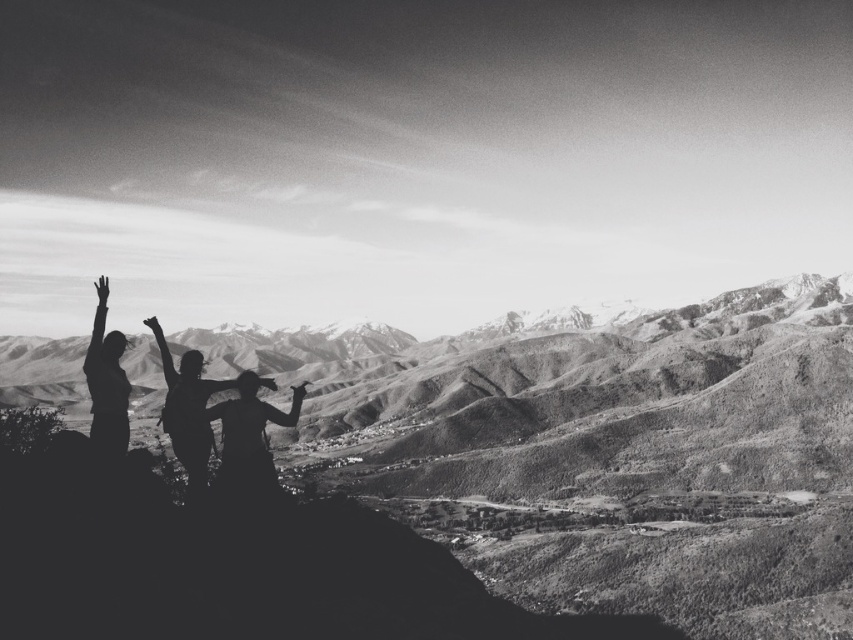
Question: Can you confirm if silhouette figure at center is positioned above silvery metallic arm at upper left?

Choices:
 (A) yes
 (B) no

Answer: (B)

Question: Which point is closer to the camera?

Choices:
 (A) smooth skin arm at center
 (B) silvery metallic arm at upper left
 (C) silhouette figure at center
 (D) silhouette cowboy hat at center

Answer: (D)

Question: Does silhouette figure at left have a larger size compared to black matte hand at upper left?

Choices:
 (A) no
 (B) yes

Answer: (B)

Question: From the image, what is the correct spatial relationship of black matte arm at center in relation to black matte hand at upper left?

Choices:
 (A) left
 (B) right

Answer: (A)

Question: Which point is closer to the camera?

Choices:
 (A) silhouette figure at center
 (B) silhouette figure at left
 (C) black matte hand at center
 (D) rugged stone mountain at center

Answer: (D)

Question: Which of the following is the farthest from the observer?

Choices:
 (A) (389, 502)
 (B) (146, 323)

Answer: (A)